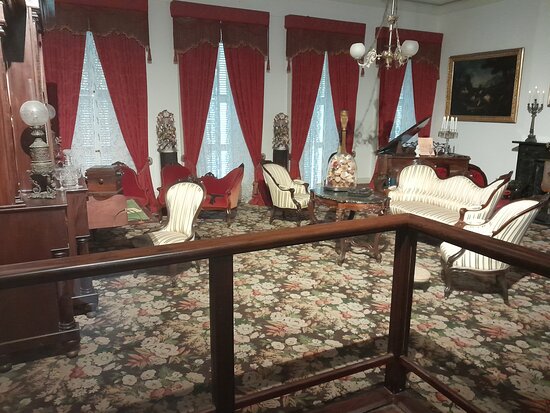
Where is `shutters`? The width and height of the screenshot is (550, 413). shutters is located at coordinates (74, 111), (233, 124), (320, 133), (408, 112).